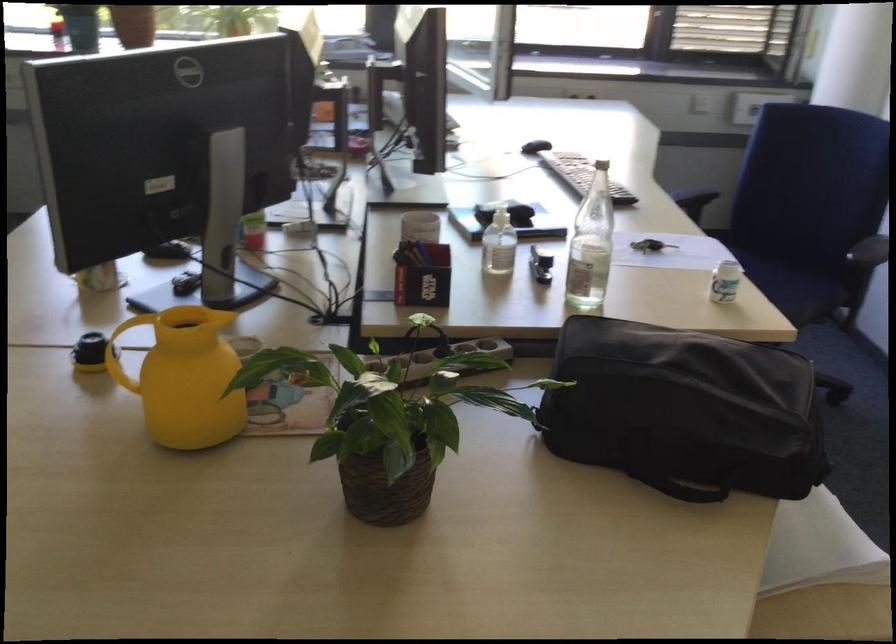
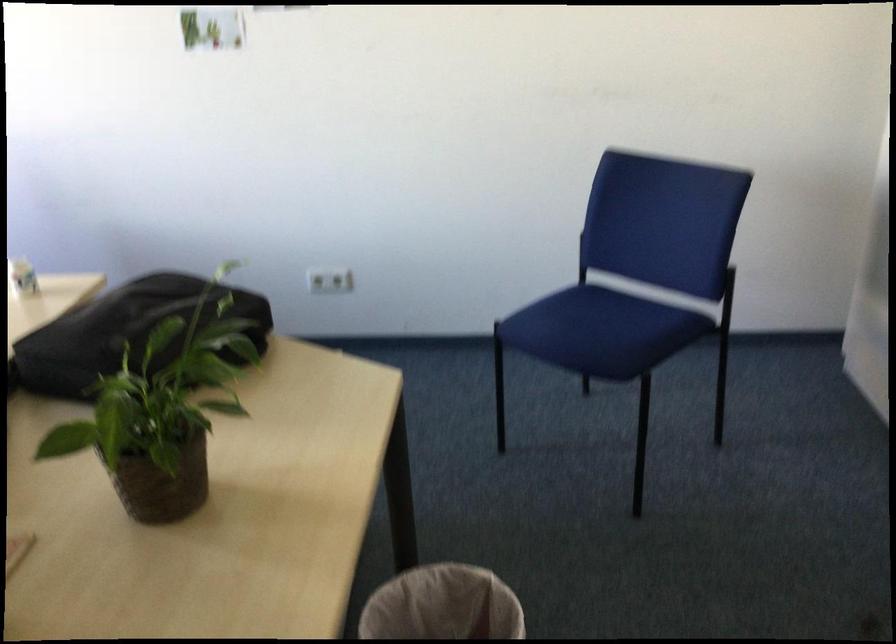
Locate, in the second image, the point that corresponds to (605,365) in the first image.

(125, 333)